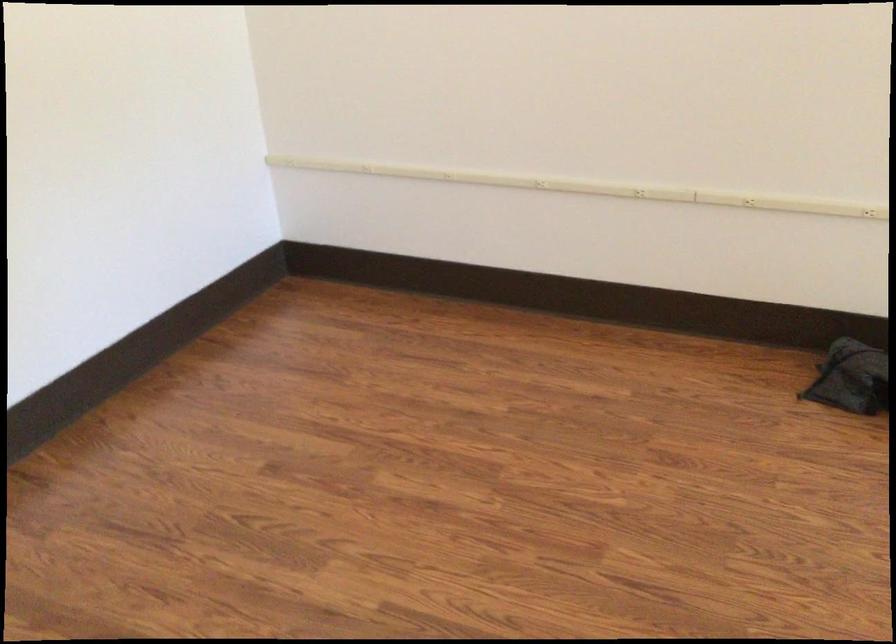
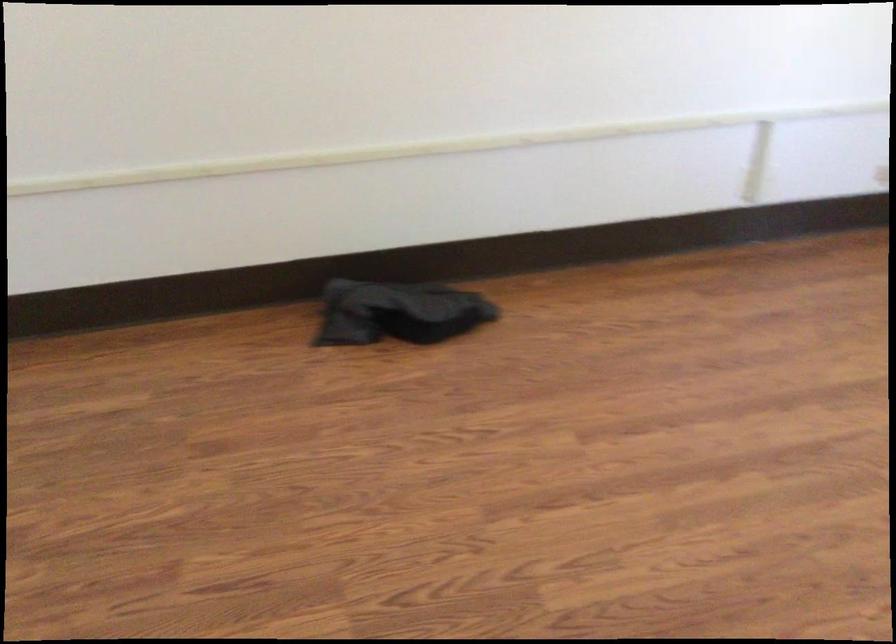
Question: How did the camera likely rotate?

Choices:
 (A) Left
 (B) Right
 (C) Up
 (D) Down

Answer: (B)